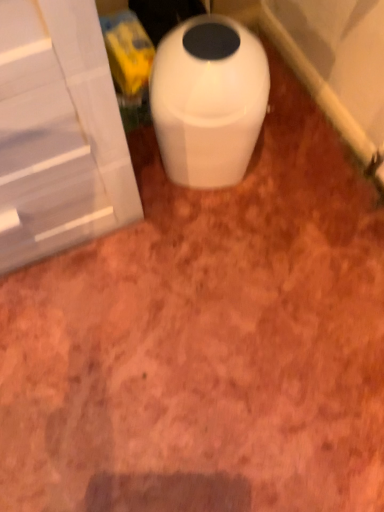
Locate an element on the screen. free space on the front side of white glossy trash can at center is located at coordinates pos(206,233).